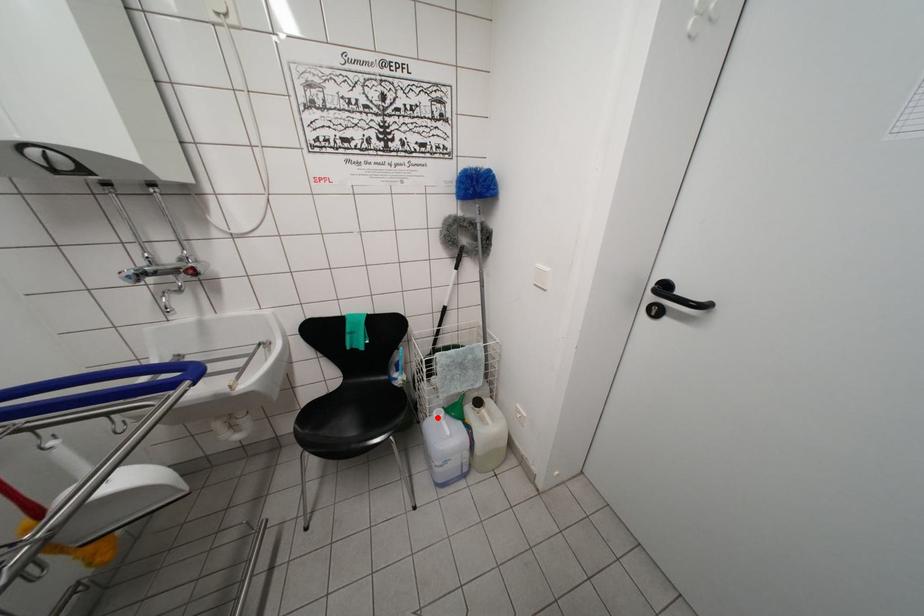
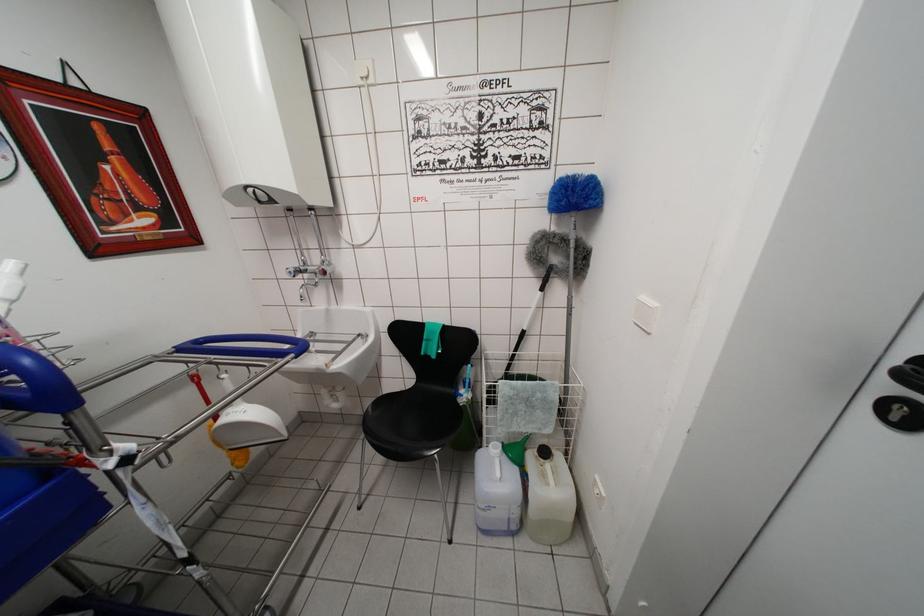
Question: I am providing you with two images of the same scene from different viewpoints. Image1 has a red point marked. In image2, the corresponding 3D location appears at what relative position? Reply with the corresponding letter.

Choices:
 (A) Closer
 (B) Farther

Answer: (A)